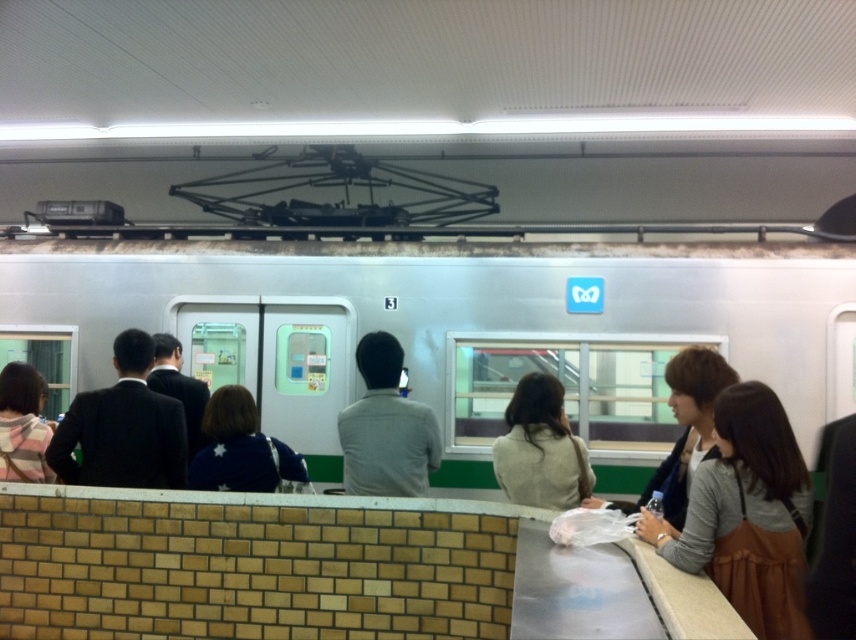
Can you confirm if brown leather bag at right is positioned to the right of dark brown hair at center?

Yes, brown leather bag at right is to the right of dark brown hair at center.

Locate an element on the screen. The image size is (856, 640). brown leather bag at right is located at coordinates (747, 515).

Locate an element on the screen. Image resolution: width=856 pixels, height=640 pixels. brown leather bag at right is located at coordinates (747, 515).

Does silver metallic train at center have a lesser height compared to plaid fabric jacket at left?

No, silver metallic train at center is not shorter than plaid fabric jacket at left.

Does silver metallic train at center appear under plaid fabric jacket at left?

Actually, silver metallic train at center is above plaid fabric jacket at left.

This screenshot has width=856, height=640. Find the location of `silver metallic train at center`. silver metallic train at center is located at coordinates (444, 314).

Which is more to the left, light beige sweater at center or dark brown hair at center?

light beige sweater at center is more to the left.

Who is positioned more to the right, light beige sweater at center or dark brown hair at center?

Answer: Positioned to the right is dark brown hair at center.

Who is more forward, (586, 456) or (714, 445)?

Point (714, 445) is in front.

This screenshot has width=856, height=640. Find the location of `light beige sweater at center`. light beige sweater at center is located at coordinates (539, 449).